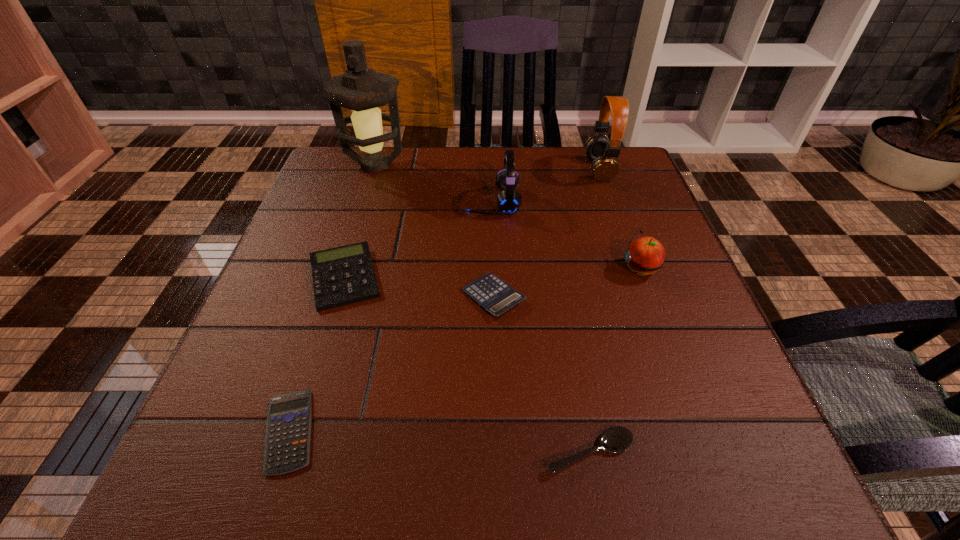
I want to click on free space located 0.130m on the front of the oil lamp, so click(359, 217).

You are a GUI agent. You are given a task and a screenshot of the screen. Output one action in this format:
    pyautogui.click(x=<x>, y=<y>)
    Task: Click on the vacant area located 0.290m on the ear cups of the seventh shortest object
    Image resolution: width=960 pixels, height=540 pixels.
    Given the screenshot: What is the action you would take?
    pyautogui.click(x=477, y=170)

The height and width of the screenshot is (540, 960). Find the location of `vacant space located 0.170m on the ear cups of the seventh shortest object`. vacant space located 0.170m on the ear cups of the seventh shortest object is located at coordinates (522, 170).

At what (x,y) coordinates should I click in order to perform the action: click on vacant region located on the ear cups of the seventh shortest object. Please return your answer as a coordinate pair (x, y). The image size is (960, 540). Looking at the image, I should click on (545, 170).

The width and height of the screenshot is (960, 540). I want to click on free space located on the ear cushions of the left headset, so click(x=441, y=202).

The width and height of the screenshot is (960, 540). I want to click on vacant space located 0.340m on the ear cushions of the left headset, so click(x=324, y=202).

Locate an element on the screen. This screenshot has width=960, height=540. free region located 0.090m on the ear cushions of the left headset is located at coordinates (428, 202).

Find the location of a particular element. free spot located on the front of the fourth tallest object is located at coordinates point(682,379).

The width and height of the screenshot is (960, 540). What are the coordinates of `free space located 0.320m on the right of the rightmost calculator` in the screenshot? It's located at (692, 297).

Find the location of a particular element. The image size is (960, 540). free space located on the left of the soupspoon is located at coordinates (447, 452).